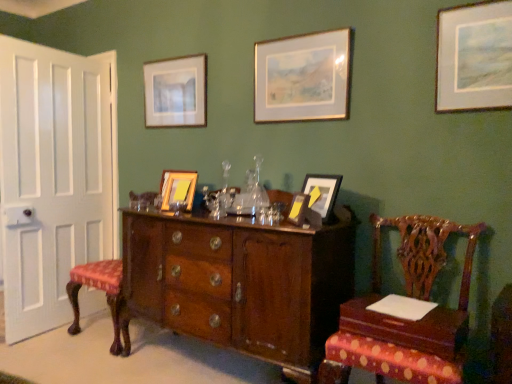
Question: Should I look upward or downward to see polished wood cabinet at center?

Choices:
 (A) up
 (B) down

Answer: (B)

Question: Which direction should I rotate to face matte brown picture frame at center, which is the fourth picture frame in back-to-front order, — up or down?

Choices:
 (A) down
 (B) up

Answer: (A)

Question: From the image's perspective, does gold-framed picture at upper center, which is counted as the fourth picture frame, starting from the front, appear lower than matte gold picture frame at center, the fifth picture frame viewed from the back?

Choices:
 (A) yes
 (B) no

Answer: (B)

Question: Considering the relative sizes of gold-framed picture at upper center, the 4th picture frame positioned from the left, and matte gold picture frame at center, positioned as the third picture frame in left-to-right order, in the image provided, is gold-framed picture at upper center, the 4th picture frame positioned from the left, smaller than matte gold picture frame at center, positioned as the third picture frame in left-to-right order,?

Choices:
 (A) yes
 (B) no

Answer: (B)

Question: Is gold-framed picture at upper center, the 4th picture frame positioned from the left, far away from matte gold picture frame at center, which is the 4th picture frame in right-to-left order?

Choices:
 (A) yes
 (B) no

Answer: (B)

Question: Can you confirm if gold-framed picture at upper center, the 4th picture frame positioned from the left, is thinner than matte gold picture frame at center, which is the 4th picture frame in right-to-left order?

Choices:
 (A) no
 (B) yes

Answer: (B)

Question: Considering the relative sizes of gold-framed picture at upper center, the 4th picture frame positioned from the left, and matte gold picture frame at center, the fifth picture frame viewed from the back, in the image provided, is gold-framed picture at upper center, the 4th picture frame positioned from the left, bigger than matte gold picture frame at center, the fifth picture frame viewed from the back,?

Choices:
 (A) yes
 (B) no

Answer: (A)

Question: Is gold-framed picture at upper center, the 4th picture frame positioned from the left, facing towards matte gold picture frame at center, which is the 4th picture frame in right-to-left order?

Choices:
 (A) no
 (B) yes

Answer: (A)

Question: Could you tell me if wooden chair with upholstered seat at left, which is counted as the second chair, starting from the front, is facing matte wooden picture frame at upper center, marked as the 6th picture frame in a right-to-left arrangement?

Choices:
 (A) no
 (B) yes

Answer: (A)

Question: Is matte wooden picture frame at upper center, the 1th picture frame positioned from the left, completely or partially inside wooden chair with upholstered seat at left, the 1th chair when ordered from left to right?

Choices:
 (A) yes
 (B) no

Answer: (B)

Question: Is wooden chair with upholstered seat at left, marked as the second chair in a right-to-left arrangement, in contact with matte wooden picture frame at upper center, acting as the 6th picture frame starting from the front?

Choices:
 (A) yes
 (B) no

Answer: (B)

Question: Is wooden chair with upholstered seat at left, which is counted as the second chair, starting from the front, closer to the viewer compared to matte wooden picture frame at upper center, which ranks as the first picture frame in back-to-front order?

Choices:
 (A) no
 (B) yes

Answer: (B)

Question: Does wooden chair with upholstered seat at left, marked as the second chair in a right-to-left arrangement, have a lesser height compared to matte wooden picture frame at upper center, the 1th picture frame positioned from the left?

Choices:
 (A) no
 (B) yes

Answer: (A)

Question: Does wooden chair with upholstered seat at left, which is the 1th chair in back-to-front order, have a greater height compared to matte wooden picture frame at upper center, acting as the 6th picture frame starting from the front?

Choices:
 (A) yes
 (B) no

Answer: (A)

Question: Does polished wood chair at right, acting as the 2th chair starting from the left, have a larger size compared to wooden picture frame at center, the second picture frame from the back?

Choices:
 (A) yes
 (B) no

Answer: (A)